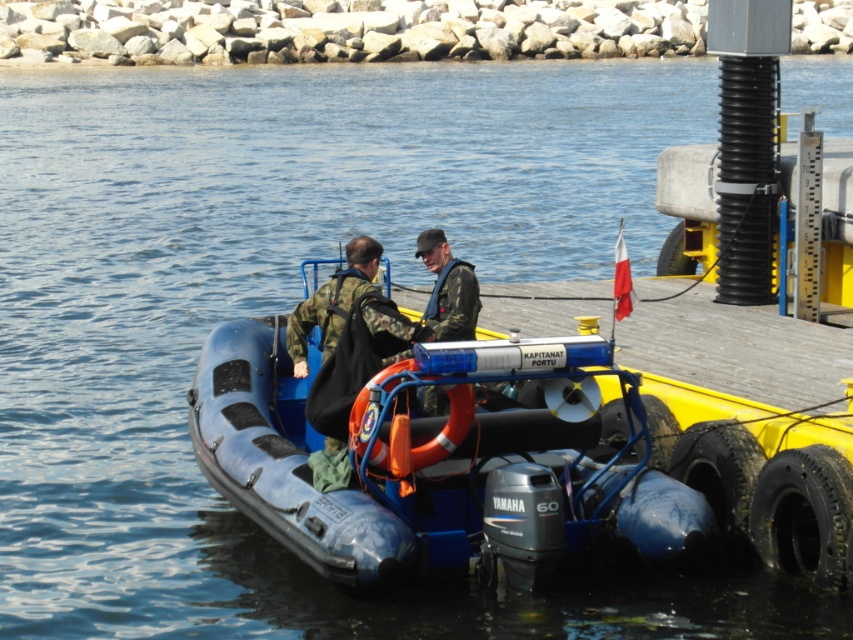
Based on the photo, you are a photographer trying to capture the blue rubber boat at center and the orange rubber life jacket at center in a single shot. Based on their positions, which object will appear larger in your photo?

The blue rubber boat at center will appear larger in the photo because it is closer to the viewer than the orange rubber life jacket at center.

You are a rescue team member who needs to secure the orange rubber life jacket at center to the blue rubber boat at center. Based on their sizes, will the life jacket fit on the boat without overhanging the sides?

A: The blue rubber boat at center might be wider than orange rubber life jacket at center, so there is a possibility that the life jacket will fit without overhanging the sides, but the exact dimensions are uncertain.